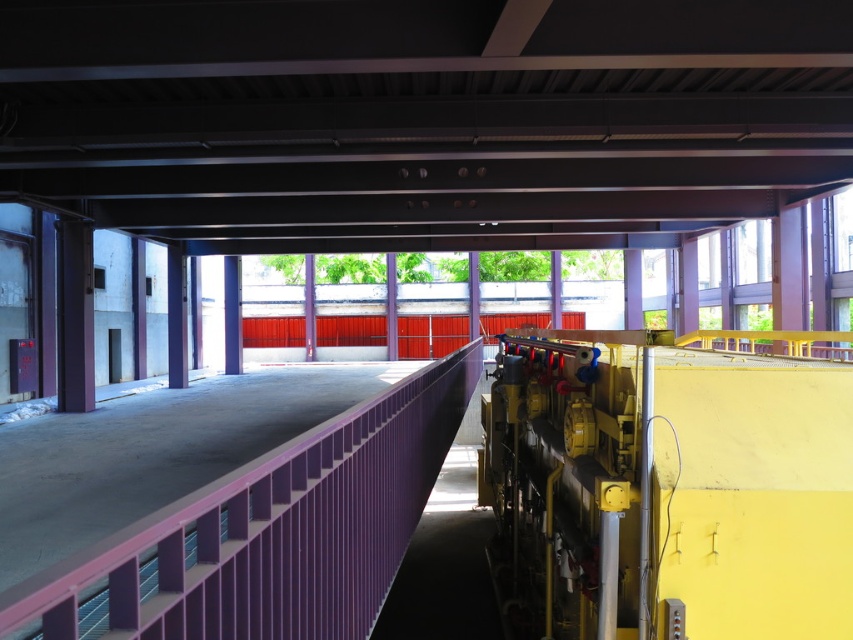
You are an inspector standing at the entrance of the construction site. You need to check the metal at center and the purple metallic rail at center. According to the scene, which one is located to the left when facing towards the center of the area?

The metal at center is positioned on the left side of purple metallic rail at center, so the metal at center is located to the left when facing towards the center of the area.